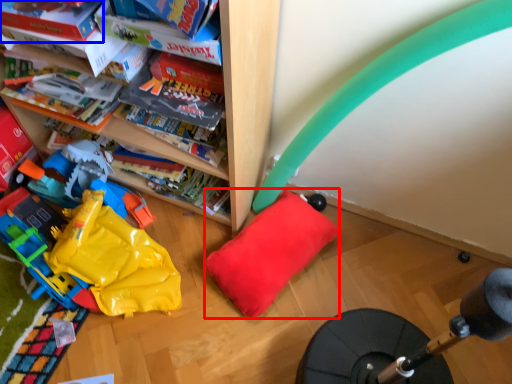
Question: Which object appears closest to the camera in this image, pillow (highlighted by a red box) or book (highlighted by a blue box)?

Choices:
 (A) pillow
 (B) book

Answer: (B)